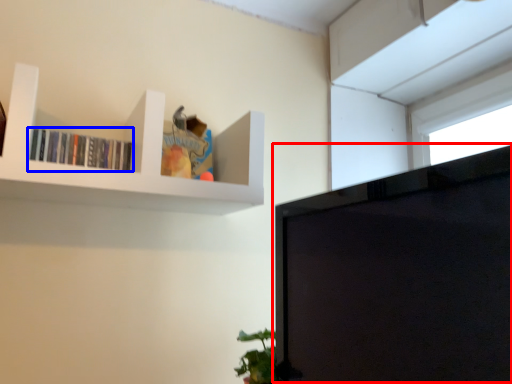
Question: Which point is closer to the camera, computer monitor (highlighted by a red box) or book (highlighted by a blue box)?

Choices:
 (A) computer monitor
 (B) book

Answer: (A)